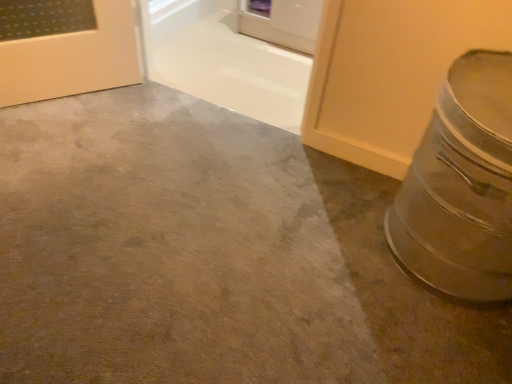
Measure the distance between point (271, 22) and camera.

7.13 feet.

What do you see at coordinates (168, 249) in the screenshot?
I see `smooth concrete at lower right` at bounding box center [168, 249].

Locate an element on the screen. This screenshot has height=384, width=512. white glossy door at upper center is located at coordinates (281, 22).

Between white glossy door at upper center and smooth concrete at lower right, which one has less height?

With less height is smooth concrete at lower right.

Are white glossy door at upper center and smooth concrete at lower right located far from each other?

Yes, white glossy door at upper center and smooth concrete at lower right are located far from each other.

Is white glossy door at upper center wider than smooth concrete at lower right?

No.

Is smooth concrete at lower right surrounded by white glossy door at upper center?

No.

Between point (280, 211) and point (302, 50), which one is positioned behind?

The point (302, 50) is farther.

Based on the photo, considering the relative positions of smooth concrete at lower right and white glossy door at upper center in the image provided, is smooth concrete at lower right to the right of white glossy door at upper center from the viewer's perspective?

No, smooth concrete at lower right is not to the right of white glossy door at upper center.

Is smooth concrete at lower right turned away from white glossy door at upper center?

No.

Is smooth concrete at lower right beside white glossy door at upper center?

No, smooth concrete at lower right is not next to white glossy door at upper center.

Find the location of `crock pot in front of the white glossy door at upper center`. crock pot in front of the white glossy door at upper center is located at coordinates (461, 186).

Is point (284, 16) positioned before point (398, 212)?

No, it is behind (398, 212).

Who is smaller, white glossy door at upper center or silver metallic crock pot at right?

With smaller size is white glossy door at upper center.

Between white glossy door at upper center and silver metallic crock pot at right, which one appears on the left side from the viewer's perspective?

Positioned to the left is white glossy door at upper center.

Based on the photo, is silver metallic crock pot at right outside of white glossy door at upper center?

Yes.

Find the location of a particular element. This screenshot has height=384, width=512. door located underneath the silver metallic crock pot at right (from a real-world perspective) is located at coordinates (281, 22).

Which of these two, silver metallic crock pot at right or white glossy door at upper center, is bigger?

With larger size is silver metallic crock pot at right.

From the image's perspective, is smooth concrete at lower right located beneath silver metallic crock pot at right?

Indeed, from the image's perspective, smooth concrete at lower right is shown beneath silver metallic crock pot at right.

Is smooth concrete at lower right positioned far away from silver metallic crock pot at right?

No, smooth concrete at lower right is in close proximity to silver metallic crock pot at right.

Locate an element on the screen. crock pot behind the smooth concrete at lower right is located at coordinates (461, 186).

From a real-world perspective, which object rests below the other?

smooth concrete at lower right is physically lower.

Considering the sizes of objects silver metallic crock pot at right and smooth concrete at lower right in the image provided, who is smaller, silver metallic crock pot at right or smooth concrete at lower right?

With smaller size is smooth concrete at lower right.

Is point (444, 256) positioned behind point (93, 330)?

Yes.

Looking at this image, would you say silver metallic crock pot at right is a long distance from smooth concrete at lower right?

silver metallic crock pot at right is actually quite close to smooth concrete at lower right.

From the picture: Between silver metallic crock pot at right and smooth concrete at lower right, which one is positioned in front?

Positioned in front is smooth concrete at lower right.

I want to click on door located behind the smooth concrete at lower right, so click(x=281, y=22).

The height and width of the screenshot is (384, 512). What are the coordinates of `door that appears above the smooth concrete at lower right (from a real-world perspective)` in the screenshot? It's located at (281, 22).

From the image, which object appears to be farther from silver metallic crock pot at right, smooth concrete at lower right or white glossy door at upper center?

white glossy door at upper center is further to silver metallic crock pot at right.

From the image, which object appears to be nearer to smooth concrete at lower right, white glossy door at upper center or silver metallic crock pot at right?

silver metallic crock pot at right.

When comparing their distances from smooth concrete at lower right, does silver metallic crock pot at right or white glossy door at upper center seem closer?

Among the two, silver metallic crock pot at right is located nearer to smooth concrete at lower right.

Looking at the image, which one is located closer to silver metallic crock pot at right, white glossy door at upper center or smooth concrete at lower right?

smooth concrete at lower right is closer to silver metallic crock pot at right.

From the image, which object appears to be farther from white glossy door at upper center, silver metallic crock pot at right or smooth concrete at lower right?

Among the two, silver metallic crock pot at right is located further to white glossy door at upper center.

When comparing their distances from white glossy door at upper center, does smooth concrete at lower right or silver metallic crock pot at right seem closer?

Based on the image, smooth concrete at lower right appears to be nearer to white glossy door at upper center.

Identify the location of crock pot between smooth concrete at lower right and white glossy door at upper center from front to back. (461, 186).